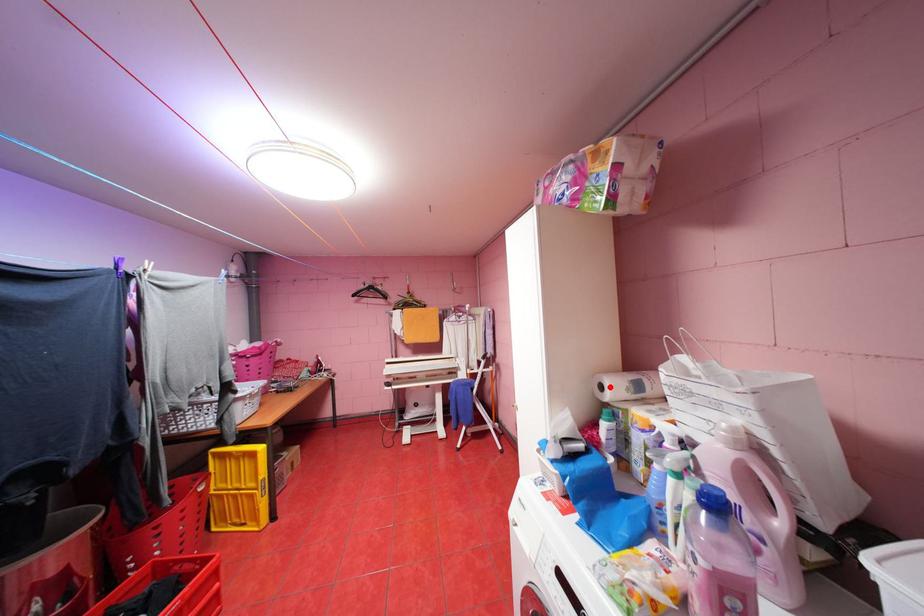
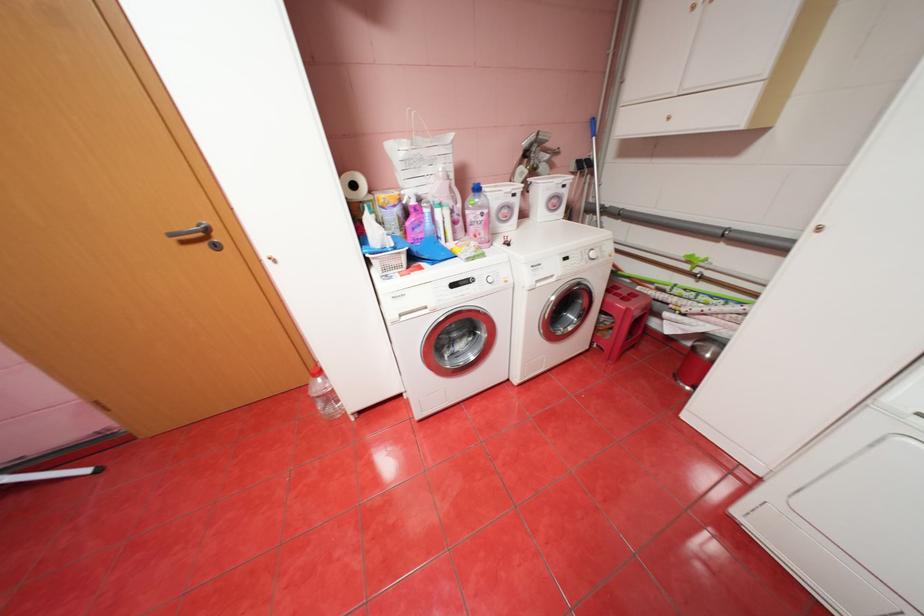
Question: A red point is marked in image1. In image2, is the corresponding 3D point closer to the camera or farther? Reply with the corresponding letter.

Choices:
 (A) The corresponding 3D point is closer.
 (B) The corresponding 3D point is farther.

Answer: (A)